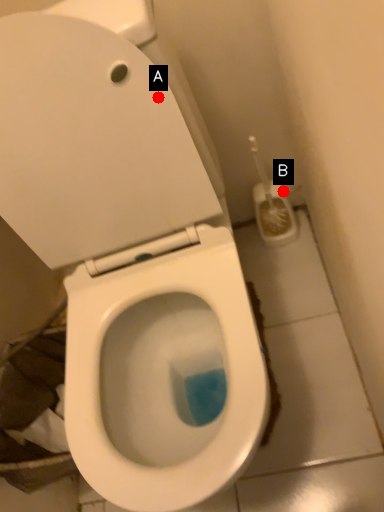
Question: Two points are circled on the image, labeled by A and B beside each circle. Which point appears closest to the camera in this image?

Choices:
 (A) A is closer
 (B) B is closer

Answer: (A)